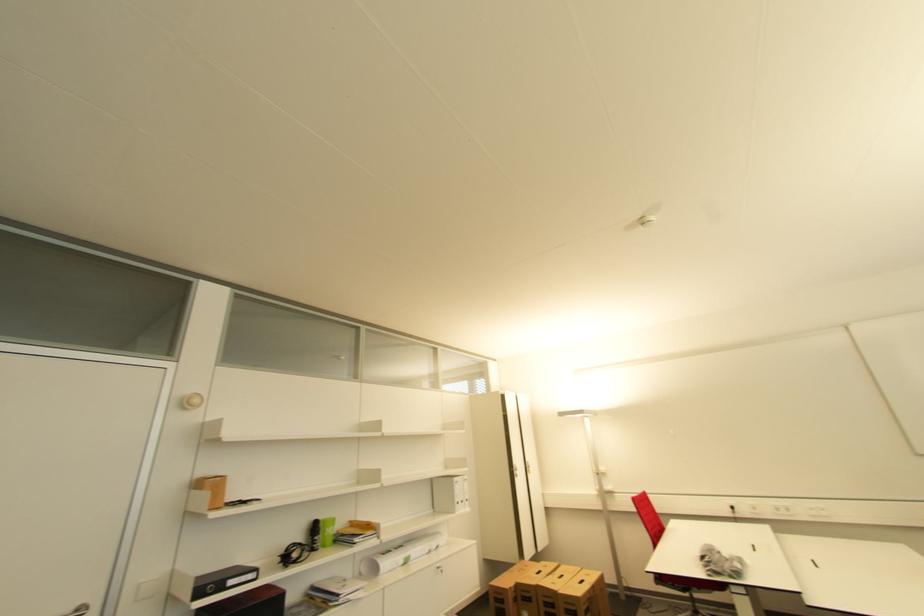
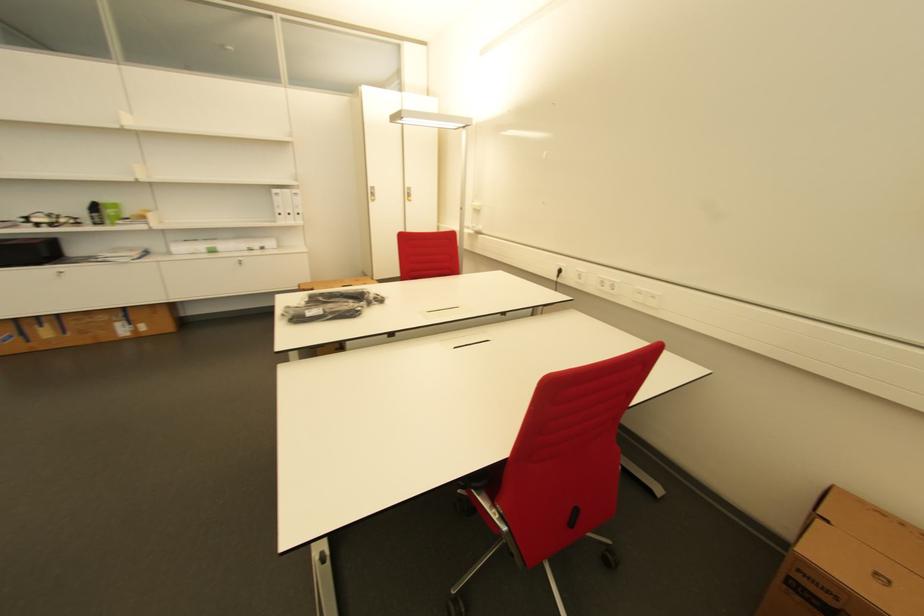
The point at (x=789, y=513) is marked in the first image. Where is the corresponding point in the second image?

(612, 289)